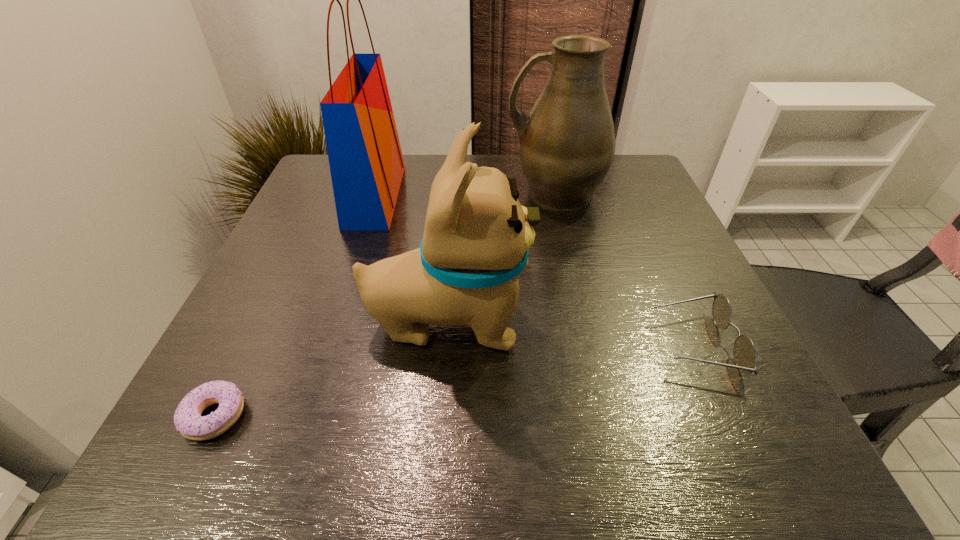
The height and width of the screenshot is (540, 960). In order to click on the tallest object in this screenshot , I will do `click(366, 163)`.

At what (x,y) coordinates should I click in order to perform the action: click on puppy. Please return your answer as a coordinate pair (x, y). The image size is (960, 540). Looking at the image, I should click on (477, 235).

Where is `pitcher`? The width and height of the screenshot is (960, 540). pitcher is located at coordinates (567, 143).

Find the location of a particular element. The width and height of the screenshot is (960, 540). the second shortest object is located at coordinates (745, 355).

Find the location of `the leftmost object`. the leftmost object is located at coordinates (187, 418).

This screenshot has height=540, width=960. In order to click on doughnut in this screenshot , I will do `click(187, 418)`.

Identify the location of vacant space located 0.300m on the handle side of the shopping bag. The width and height of the screenshot is (960, 540). (516, 195).

Locate an element on the screen. vacant space located on the face of the puppy is located at coordinates click(x=710, y=321).

Locate an element on the screen. free point located on the handle side of the pitcher is located at coordinates (373, 193).

Locate an element on the screen. This screenshot has width=960, height=540. vacant point located on the handle side of the pitcher is located at coordinates (385, 193).